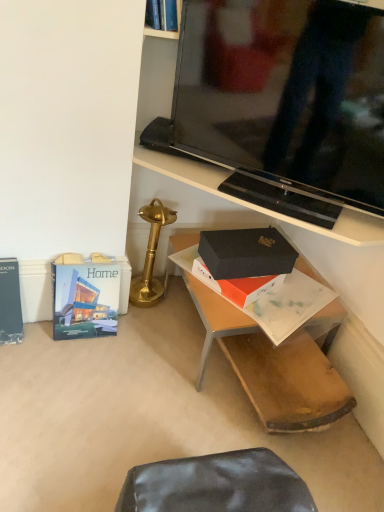
Question: Considering the relative sizes of hardcover book at lower left, which ranks as the second paperback book in left-to-right order, and black matte box at center in the image provided, is hardcover book at lower left, which ranks as the second paperback book in left-to-right order, thinner than black matte box at center?

Choices:
 (A) yes
 (B) no

Answer: (A)

Question: Can you confirm if hardcover book at lower left, which appears as the 1th paperback book when viewed from the right, is wider than black matte box at center?

Choices:
 (A) no
 (B) yes

Answer: (A)

Question: From the image's perspective, is hardcover book at lower left, which appears as the 1th paperback book when viewed from the right, over black matte box at center?

Choices:
 (A) yes
 (B) no

Answer: (B)

Question: Can you confirm if hardcover book at lower left, which appears as the 1th paperback book when viewed from the right, is shorter than black matte box at center?

Choices:
 (A) yes
 (B) no

Answer: (B)

Question: Is hardcover book at lower left, which appears as the 1th paperback book when viewed from the right, next to black matte box at center?

Choices:
 (A) yes
 (B) no

Answer: (B)

Question: In the image, is black glossy tv stand at upper center on the left side or the right side of gold polished table lamp at center?

Choices:
 (A) left
 (B) right

Answer: (B)

Question: Looking at their shapes, would you say black glossy tv stand at upper center is wider or thinner than gold polished table lamp at center?

Choices:
 (A) wide
 (B) thin

Answer: (B)

Question: From the image's perspective, relative to gold polished table lamp at center, is black glossy tv stand at upper center above or below?

Choices:
 (A) above
 (B) below

Answer: (A)

Question: From a real-world perspective, is black glossy tv stand at upper center positioned above or below gold polished table lamp at center?

Choices:
 (A) below
 (B) above

Answer: (B)

Question: Is gold polished table lamp at center spatially inside hardcover book at left, acting as the first paperback book starting from the left, or outside of it?

Choices:
 (A) outside
 (B) inside

Answer: (A)

Question: In the image, is gold polished table lamp at center on the left side or the right side of hardcover book at left, positioned as the second paperback book in right-to-left order?

Choices:
 (A) right
 (B) left

Answer: (A)

Question: Considering their positions, is gold polished table lamp at center located in front of or behind hardcover book at left, acting as the first paperback book starting from the left?

Choices:
 (A) behind
 (B) front

Answer: (A)

Question: Is gold polished table lamp at center taller or shorter than hardcover book at left, positioned as the second paperback book in right-to-left order?

Choices:
 (A) tall
 (B) short

Answer: (A)

Question: Relative to black matte box at center, is black matte box at center in front or behind?

Choices:
 (A) behind
 (B) front

Answer: (A)

Question: Is black matte box at center to the left or to the right of black matte box at center in the image?

Choices:
 (A) right
 (B) left

Answer: (A)